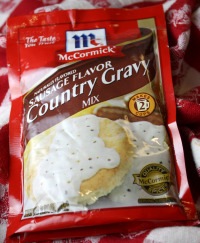
Where is `tablecloth`? Image resolution: width=200 pixels, height=243 pixels. tablecloth is located at coordinates (187, 104).